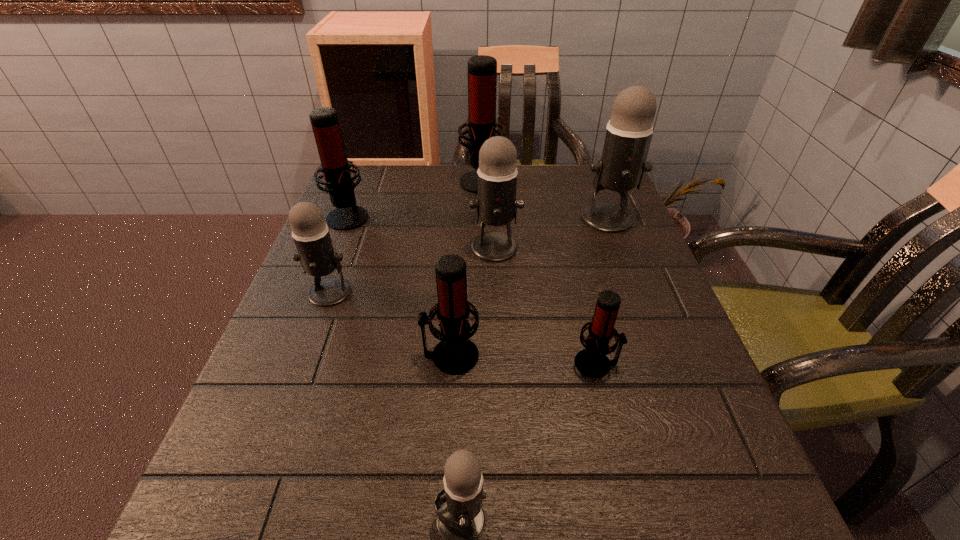
At what (x,y) coordinates should I click in order to perform the action: click on vacant space in between the rightmost gray microphone and the second smallest red microphone. Please return your answer as a coordinate pair (x, y). Looking at the image, I should click on (529, 287).

You are a GUI agent. You are given a task and a screenshot of the screen. Output one action in this format:
    pyautogui.click(x=<x>, y=<y>)
    Task: Click on the vacant point located between the farthest object and the third biggest red microphone
    
    Given the screenshot: What is the action you would take?
    pyautogui.click(x=467, y=268)

Find the location of `vacant region between the smallest red microphone and the third nearest red microphone`. vacant region between the smallest red microphone and the third nearest red microphone is located at coordinates (472, 289).

Identify which object is located as the seventh nearest to the second smallest red microphone. Please provide its 2D coordinates. Your answer should be formatted as a tuple, i.e. [(x, y)], where the tuple contains the x and y coordinates of a point satisfying the conditions above.

[(482, 70)]

Identify which object is the sixth nearest to the smallest red microphone. Please provide its 2D coordinates. Your answer should be formatted as a tuple, i.e. [(x, y)], where the tuple contains the x and y coordinates of a point satisfying the conditions above.

[(482, 70)]

The width and height of the screenshot is (960, 540). I want to click on microphone that is the fourth closest to the third smallest gray microphone, so click(316, 254).

Image resolution: width=960 pixels, height=540 pixels. I want to click on microphone that is the sixth nearest to the nearest gray microphone, so click(x=335, y=166).

In order to click on red microphone that is the third closest to the nearest gray microphone in this screenshot , I will do `click(335, 166)`.

Locate which red microphone ranks third in proximity to the rightmost gray microphone. Please provide its 2D coordinates. Your answer should be formatted as a tuple, i.e. [(x, y)], where the tuple contains the x and y coordinates of a point satisfying the conditions above.

[(455, 354)]

Select which gray microphone is the closest to the second farthest red microphone. Please provide its 2D coordinates. Your answer should be formatted as a tuple, i.e. [(x, y)], where the tuple contains the x and y coordinates of a point satisfying the conditions above.

[(316, 254)]